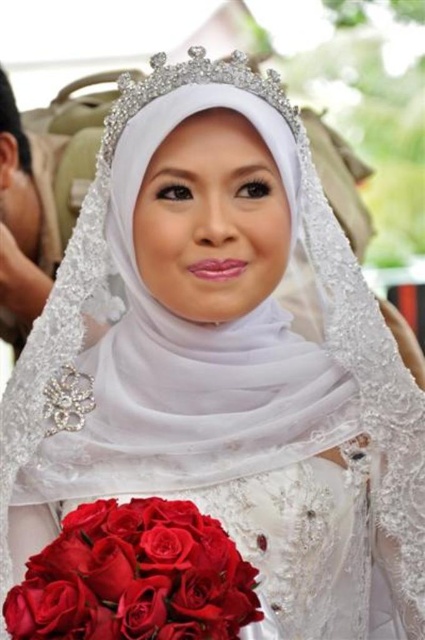
Question: Does shiny silk bouquet at lower left appear on the left side of clear crystal tiara at upper center?

Choices:
 (A) yes
 (B) no

Answer: (A)

Question: Does shiny silk bouquet at lower left appear over clear crystal tiara at upper center?

Choices:
 (A) no
 (B) yes

Answer: (A)

Question: Which of the following is the closest to the observer?

Choices:
 (A) (204, 72)
 (B) (136, 604)

Answer: (B)

Question: Does shiny silk bouquet at lower left appear under clear crystal tiara at upper center?

Choices:
 (A) no
 (B) yes

Answer: (B)